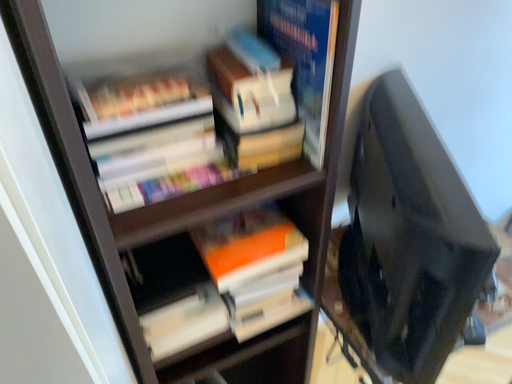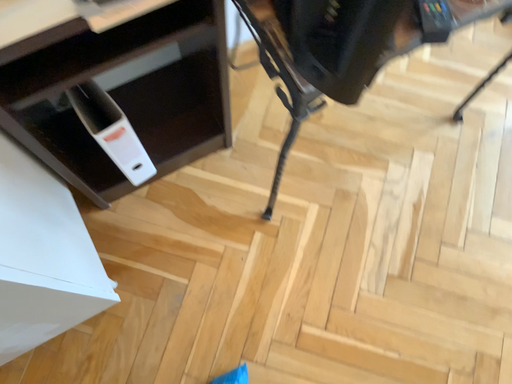
Question: Which way did the camera rotate in the video?

Choices:
 (A) rotated upward
 (B) rotated downward

Answer: (B)